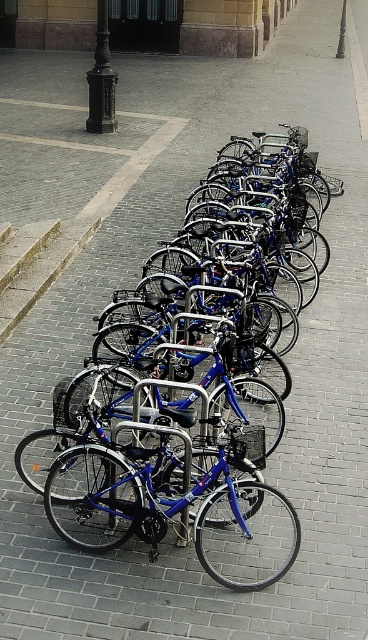
Question: Can you confirm if shiny blue bicycle at center is positioned to the right of black polished metal pole at upper left?

Choices:
 (A) yes
 (B) no

Answer: (A)

Question: Is gray concrete curb at lower left bigger than black metal pole at upper center?

Choices:
 (A) no
 (B) yes

Answer: (A)

Question: Which object is positioned closest to the black polished metal pole at upper left?

Choices:
 (A) gray concrete curb at lower left
 (B) black metal pole at upper left

Answer: (B)

Question: Which object is the farthest from the black metal pole at upper left?

Choices:
 (A) brick pavement at center
 (B) black polished metal pole at upper left
 (C) gray concrete curb at lower left
 (D) shiny blue bicycle at center

Answer: (D)

Question: Does shiny blue bicycle at center appear on the left side of black polished metal pole at upper left?

Choices:
 (A) yes
 (B) no

Answer: (B)

Question: Considering the real-world distances, which object is closest to the black polished metal pole at upper left?

Choices:
 (A) black metal pole at upper left
 (B) black metal pole at upper center

Answer: (A)